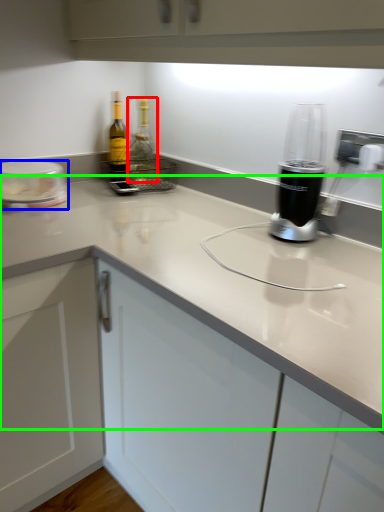
Question: Estimate the real-world distances between objects in this image. Which object is closer to bottle (highlighted by a red box), kitchen appliance (highlighted by a blue box) or counter top (highlighted by a green box)?

Choices:
 (A) kitchen appliance
 (B) counter top

Answer: (A)